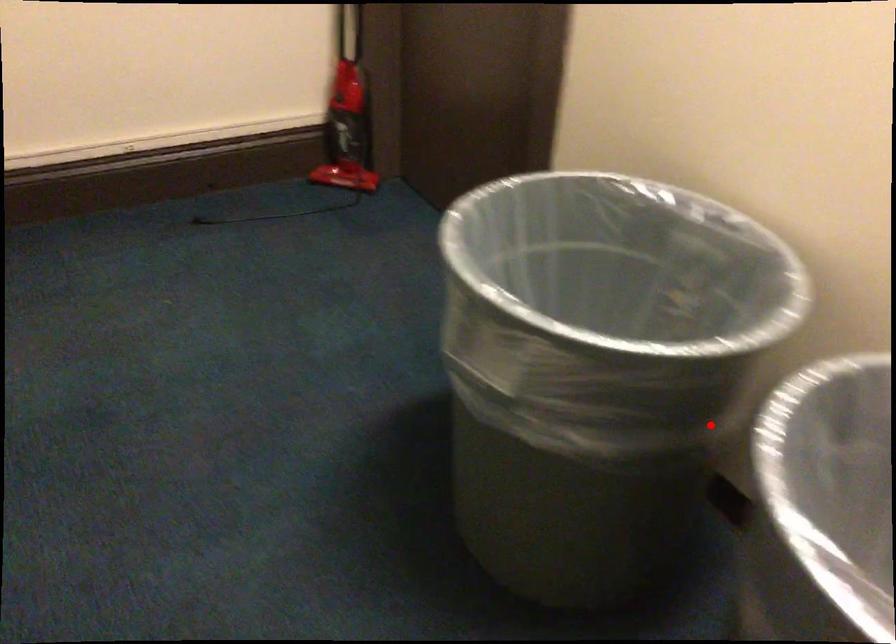
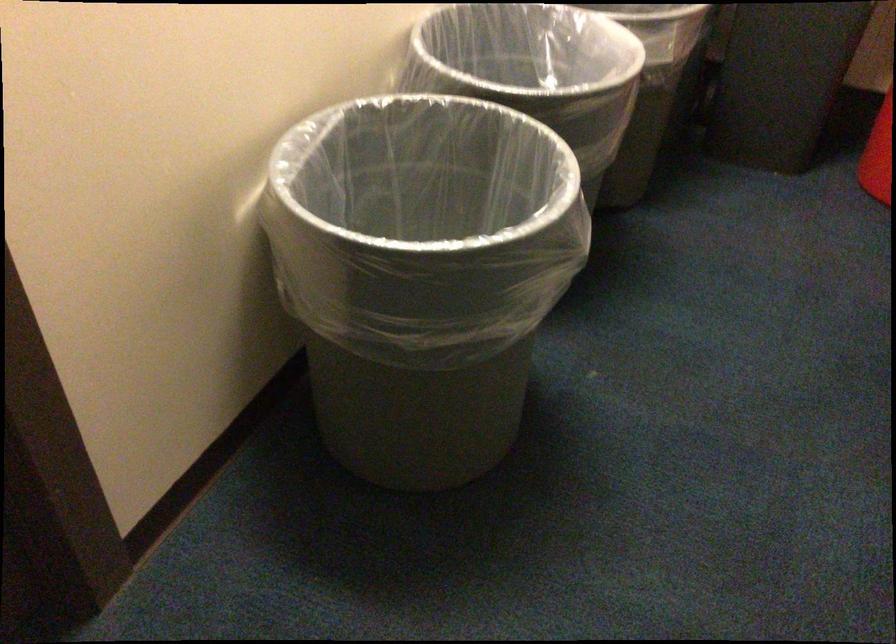
Question: A red point is marked in image1. In image2, is the corresponding 3D point closer to the camera or farther? Reply with the corresponding letter.

Choices:
 (A) The corresponding 3D point is closer.
 (B) The corresponding 3D point is farther.

Answer: (B)